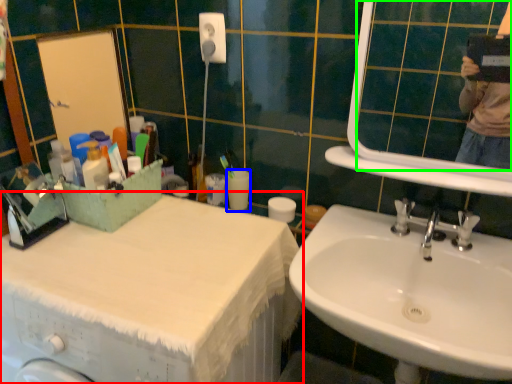
Question: Which is farther away from counter top (highlighted by a red box)? toilet paper (highlighted by a blue box) or mirror (highlighted by a green box)?

Choices:
 (A) toilet paper
 (B) mirror

Answer: (B)